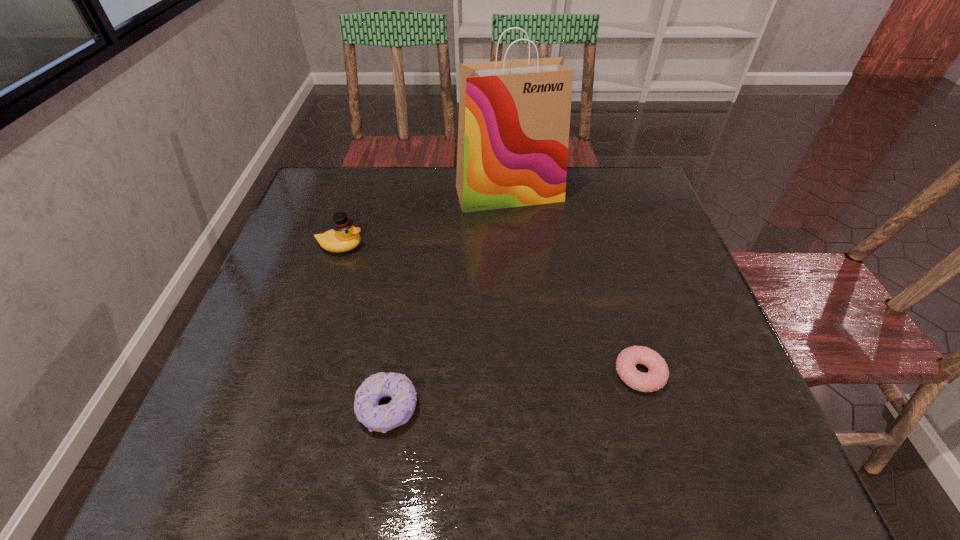
Find the location of a particular element. the farthest object is located at coordinates (514, 116).

Locate an element on the screen. The width and height of the screenshot is (960, 540). shopping bag is located at coordinates (514, 116).

This screenshot has width=960, height=540. Find the location of `the leftmost object`. the leftmost object is located at coordinates (343, 236).

At what (x,y) coordinates should I click in order to perform the action: click on duck. Please return your answer as a coordinate pair (x, y). Looking at the image, I should click on (343, 236).

Locate an element on the screen. the taller doughnut is located at coordinates (381, 418).

At what (x,y) coordinates should I click in order to perform the action: click on the left doughnut. Please return your answer as a coordinate pair (x, y). Looking at the image, I should click on (381, 418).

Image resolution: width=960 pixels, height=540 pixels. I want to click on the right doughnut, so click(x=656, y=378).

Identify the location of the rightmost object. (656, 378).

Locate an element on the screen. This screenshot has width=960, height=540. vacant space positioned 0.210m on the front of the shopping bag is located at coordinates (515, 265).

In order to click on vacant area situated on the front-facing side of the leftmost object in this screenshot , I will do `click(431, 246)`.